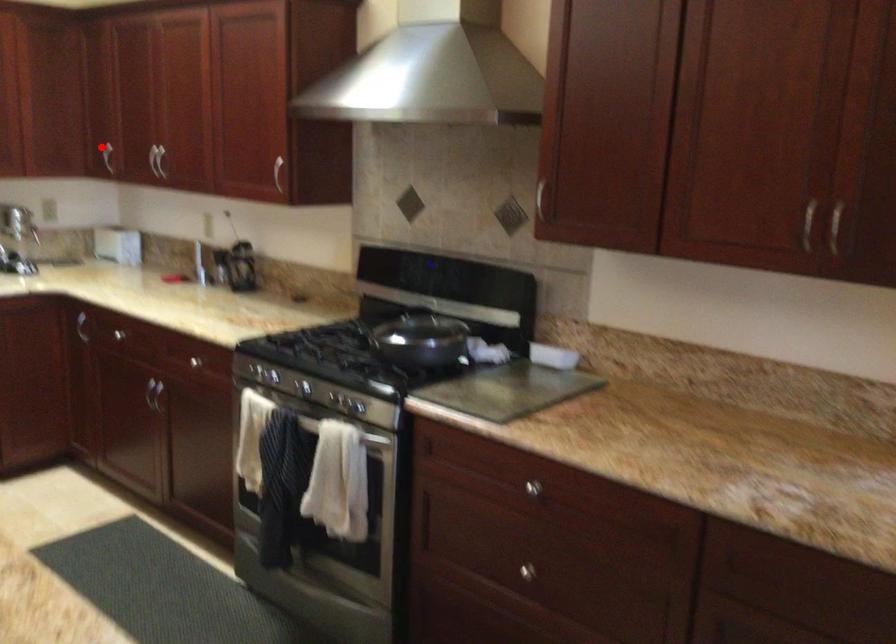
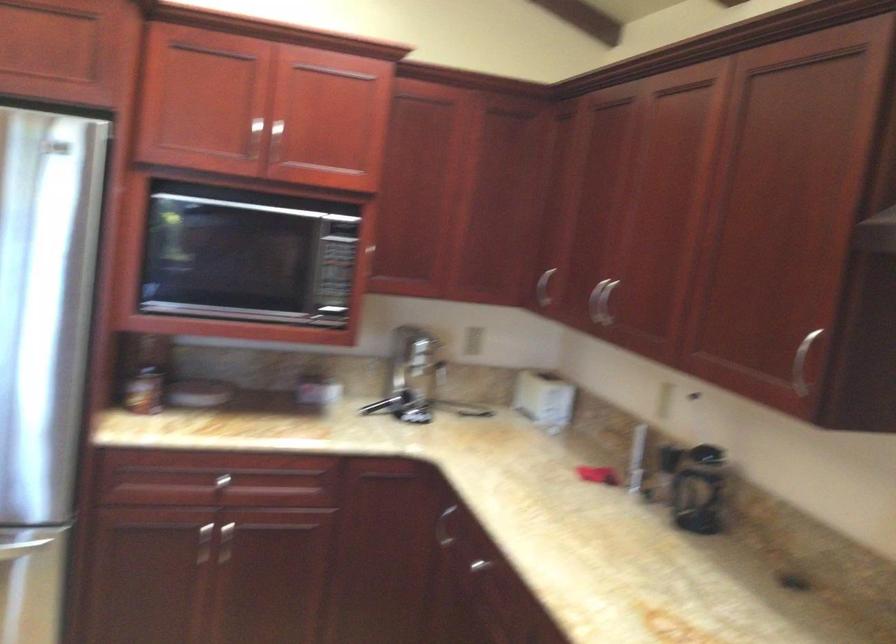
Question: A red point is marked in image1. In image2, is the corresponding 3D point closer to the camera or farther? Reply with the corresponding letter.

Choices:
 (A) The corresponding 3D point is closer.
 (B) The corresponding 3D point is farther.

Answer: (A)